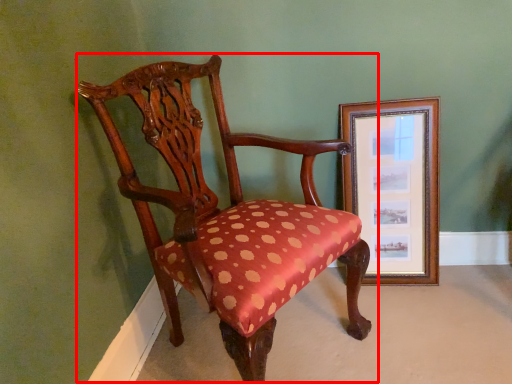
Question: From the image's perspective, where is chair (annotated by the red box) located in relation to picture frame in the image?

Choices:
 (A) below
 (B) above

Answer: (A)